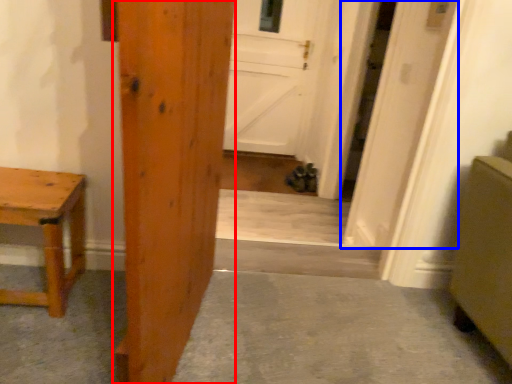
Question: Which object is closer to the camera taking this photo, door (highlighted by a red box) or door (highlighted by a blue box)?

Choices:
 (A) door
 (B) door

Answer: (A)